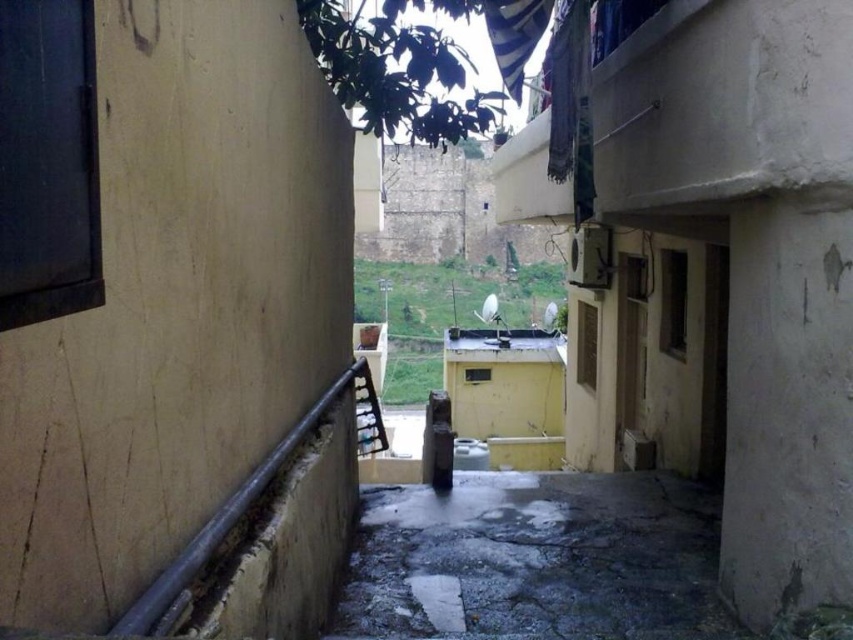
You are walking down the narrow alleyway between two buildings and notice two points marked on the ground. The first point is at coordinate (239, 508) and the second is at (378, 451). Which point is closer to you as you walk along the alley?

Point (239, 508) is closer to the viewer than point (378, 451), so the first point is closer to you.

Looking at this image, you are a delivery person carrying a large package and need to walk through the narrow alleyway. There is a rusty metal rail at left and a wooden at center. Which object should you avoid stepping on to ensure your safety?

You should avoid stepping on the wooden at center because it is positioned to the right of the rusty metal rail at left, making it closer to the uneven ground where the package might be unstable.